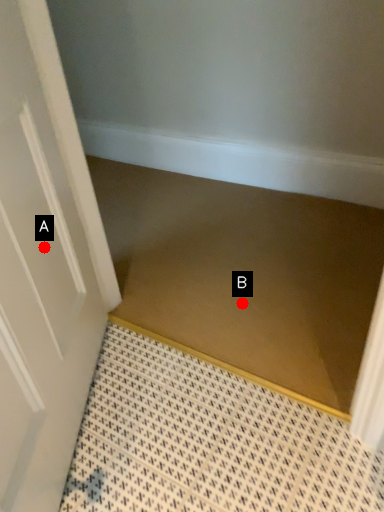
Question: Two points are circled on the image, labeled by A and B beside each circle. Which point is closer to the camera taking this photo?

Choices:
 (A) A is closer
 (B) B is closer

Answer: (A)